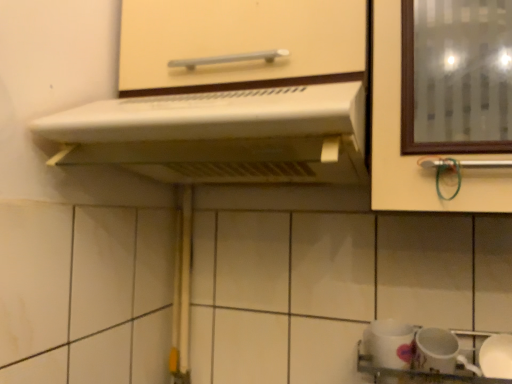
Question: Does matte white cabinet handle at upper center appear on the left side of white glossy mug at lower right, arranged as the second tableware when viewed from the left?

Choices:
 (A) yes
 (B) no

Answer: (A)

Question: Is matte white cabinet handle at upper center smaller than white glossy mug at lower right, arranged as the second tableware when viewed from the left?

Choices:
 (A) yes
 (B) no

Answer: (B)

Question: Is the depth of matte white cabinet handle at upper center greater than that of white glossy mug at lower right, the first tableware in the right-to-left sequence?

Choices:
 (A) no
 (B) yes

Answer: (A)

Question: Can you confirm if matte white cabinet handle at upper center is wider than white glossy mug at lower right, the first tableware in the right-to-left sequence?

Choices:
 (A) yes
 (B) no

Answer: (A)

Question: Is matte white cabinet handle at upper center positioned with its back to white glossy mug at lower right, the first tableware in the right-to-left sequence?

Choices:
 (A) no
 (B) yes

Answer: (A)

Question: From the image's perspective, is white plastic range hood at upper center located above or below matte white cabinet handle at upper center?

Choices:
 (A) above
 (B) below

Answer: (B)

Question: From a real-world perspective, is white plastic range hood at upper center positioned above or below matte white cabinet handle at upper center?

Choices:
 (A) below
 (B) above

Answer: (A)

Question: Would you say white plastic range hood at upper center is to the left or to the right of matte white cabinet handle at upper center in the picture?

Choices:
 (A) right
 (B) left

Answer: (B)

Question: In terms of height, does white plastic range hood at upper center look taller or shorter compared to matte white cabinet handle at upper center?

Choices:
 (A) short
 (B) tall

Answer: (A)

Question: From the image's perspective, is white glossy sink at lower right located above or below white glossy mug at lower right, arranged as the second tableware when viewed from the left?

Choices:
 (A) below
 (B) above

Answer: (A)

Question: From their relative heights in the image, would you say white glossy sink at lower right is taller or shorter than white glossy mug at lower right, arranged as the second tableware when viewed from the left?

Choices:
 (A) tall
 (B) short

Answer: (B)

Question: Is white glossy sink at lower right spatially inside white glossy mug at lower right, the first tableware in the right-to-left sequence, or outside of it?

Choices:
 (A) inside
 (B) outside

Answer: (B)

Question: Considering their positions, is white glossy sink at lower right located in front of or behind white glossy mug at lower right, arranged as the second tableware when viewed from the left?

Choices:
 (A) front
 (B) behind

Answer: (A)

Question: From the image's perspective, is white glossy mug at lower right, which appears as the second tableware when viewed from the right, positioned above or below white glossy sink at lower right?

Choices:
 (A) below
 (B) above

Answer: (B)

Question: Is white glossy mug at lower right, which appears as the second tableware when viewed from the right, situated inside white glossy sink at lower right or outside?

Choices:
 (A) outside
 (B) inside

Answer: (B)